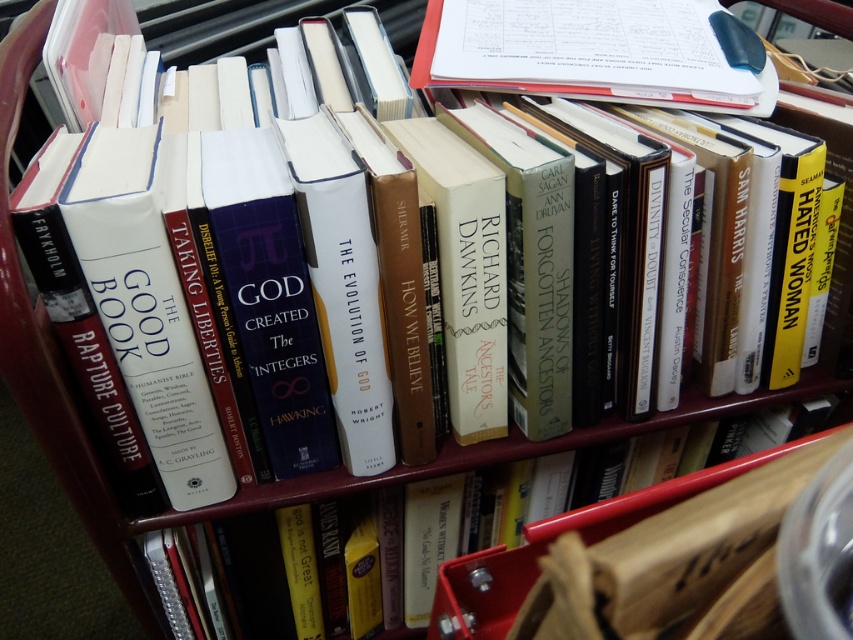
Which is behind, point (573, 49) or point (585, 531)?

The point (573, 49) is more distant.

Measure the distance between white paper notebook at upper center and camera.

71.81 centimeters

Identify the location of white paper notebook at upper center. Image resolution: width=853 pixels, height=640 pixels. (589, 52).